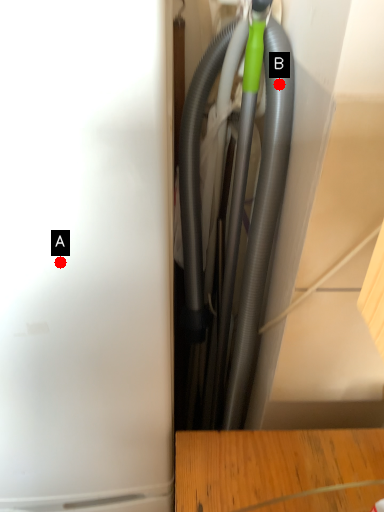
Question: Two points are circled on the image, labeled by A and B beside each circle. Which of the following is the closest to the observer?

Choices:
 (A) A is closer
 (B) B is closer

Answer: (A)